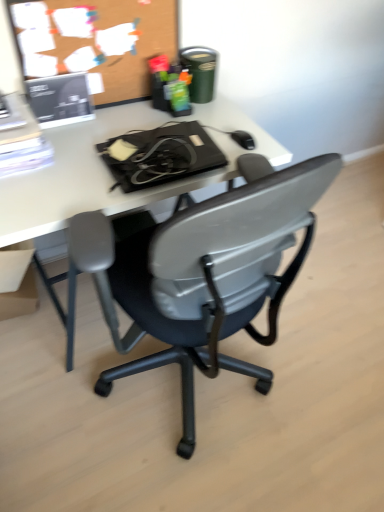
The height and width of the screenshot is (512, 384). I want to click on vacant area that lies between white plastic desk at center and matte cardboard box at lower left, so click(x=30, y=342).